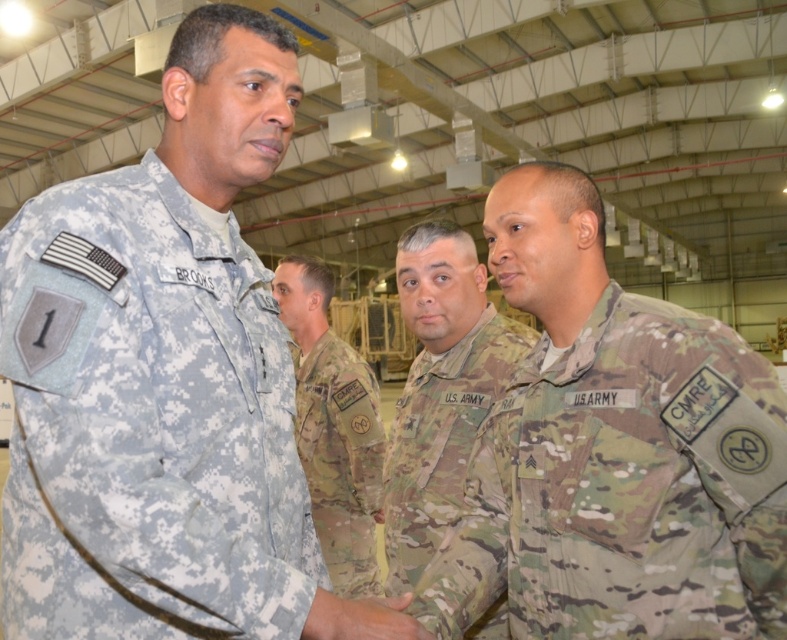
Does multicam uniform at center have a lesser height compared to camouflage fabric uniform at center?

Correct, multicam uniform at center is not as tall as camouflage fabric uniform at center.

Does multicam uniform at center have a larger size compared to camouflage fabric uniform at center?

Yes, multicam uniform at center is bigger than camouflage fabric uniform at center.

Looking at this image, measure the distance between point (446, 497) and camera.

Point (446, 497) and camera are 2.22 meters apart.

Where is `multicam uniform at center`? multicam uniform at center is located at coordinates (442, 438).

Can you confirm if camouflage fabric uniform at left is bigger than multicam uniform at center?

Incorrect, camouflage fabric uniform at left is not larger than multicam uniform at center.

Does camouflage fabric uniform at left have a greater height compared to multicam uniform at center?

No, camouflage fabric uniform at left is not taller than multicam uniform at center.

The width and height of the screenshot is (787, 640). In order to click on camouflage fabric uniform at left in this screenshot , I will do `click(150, 428)`.

Does camouflage fabric uniform at left have a smaller size compared to camouflage fabric uniform at center?

Yes, camouflage fabric uniform at left is smaller than camouflage fabric uniform at center.

Is point (50, 454) in front of point (349, 381)?

Yes, point (50, 454) is closer to viewer.

Where is `camouflage fabric uniform at left`? This screenshot has width=787, height=640. camouflage fabric uniform at left is located at coordinates (150, 428).